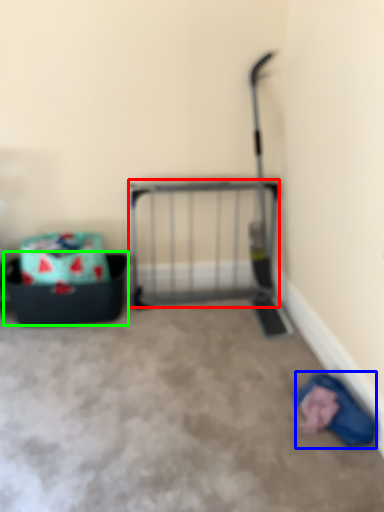
Question: Based on their relative distances, which object is nearer to cage (highlighted by a red box)? Choose from clothing (highlighted by a blue box) and storage box (highlighted by a green box).

Choices:
 (A) clothing
 (B) storage box

Answer: (B)